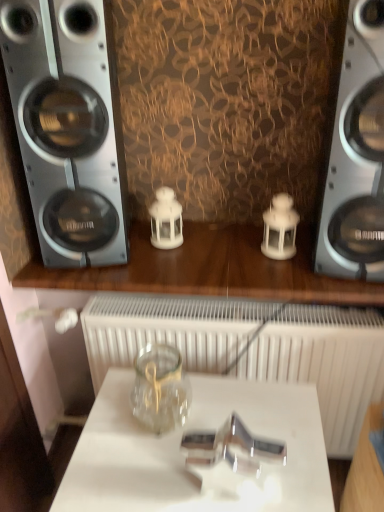
Question: Is metallic silver speaker at right, which is the first home appliance from right to left, looking in the opposite direction of silver metallic speaker at left, which is counted as the 2th home appliance, starting from the right?

Choices:
 (A) no
 (B) yes

Answer: (A)

Question: Can you confirm if metallic silver speaker at right, placed as the second home appliance when sorted from left to right, is smaller than silver metallic speaker at left, placed as the 1th home appliance when sorted from left to right?

Choices:
 (A) no
 (B) yes

Answer: (B)

Question: Is metallic silver speaker at right, placed as the second home appliance when sorted from left to right, directly adjacent to silver metallic speaker at left, which is counted as the 2th home appliance, starting from the right?

Choices:
 (A) no
 (B) yes

Answer: (A)

Question: Would you say metallic silver speaker at right, which is the first home appliance from right to left, contains silver metallic speaker at left, which is counted as the 2th home appliance, starting from the right?

Choices:
 (A) no
 (B) yes

Answer: (A)

Question: From a real-world perspective, is metallic silver speaker at right, which is the first home appliance from right to left, located higher than silver metallic speaker at left, which is counted as the 2th home appliance, starting from the right?

Choices:
 (A) yes
 (B) no

Answer: (B)

Question: Is metallic silver speaker at right, placed as the second home appliance when sorted from left to right, not inside silver metallic speaker at left, which is counted as the 2th home appliance, starting from the right?

Choices:
 (A) no
 (B) yes

Answer: (B)

Question: Are white matte radiator at center and silver metallic speaker at left, which is counted as the 2th home appliance, starting from the right, located far from each other?

Choices:
 (A) no
 (B) yes

Answer: (A)

Question: Is white matte radiator at center completely or partially outside of silver metallic speaker at left, which is counted as the 2th home appliance, starting from the right?

Choices:
 (A) yes
 (B) no

Answer: (A)

Question: From a real-world perspective, is white matte radiator at center below silver metallic speaker at left, placed as the 1th home appliance when sorted from left to right?

Choices:
 (A) no
 (B) yes

Answer: (B)

Question: Is white matte radiator at center taller than silver metallic speaker at left, placed as the 1th home appliance when sorted from left to right?

Choices:
 (A) no
 (B) yes

Answer: (A)

Question: Considering the relative sizes of white matte radiator at center and silver metallic speaker at left, placed as the 1th home appliance when sorted from left to right, in the image provided, is white matte radiator at center thinner than silver metallic speaker at left, placed as the 1th home appliance when sorted from left to right,?

Choices:
 (A) no
 (B) yes

Answer: (A)

Question: Considering the relative sizes of white matte radiator at center and silver metallic speaker at left, placed as the 1th home appliance when sorted from left to right, in the image provided, is white matte radiator at center shorter than silver metallic speaker at left, placed as the 1th home appliance when sorted from left to right,?

Choices:
 (A) yes
 (B) no

Answer: (A)

Question: Is silver metallic speaker at left, which is counted as the 2th home appliance, starting from the right, smaller than transparent glass jar at center?

Choices:
 (A) no
 (B) yes

Answer: (B)